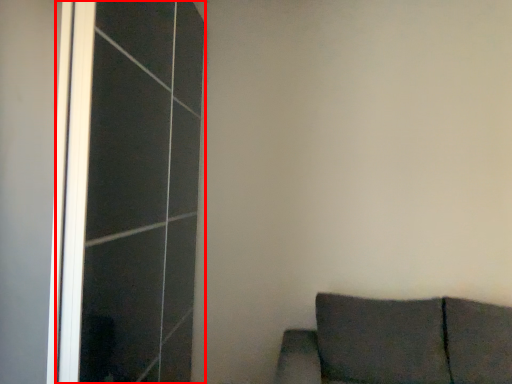
Question: From the image, what is the correct spatial relationship of screen door (annotated by the red box) in relation to furniture?

Choices:
 (A) right
 (B) left

Answer: (B)